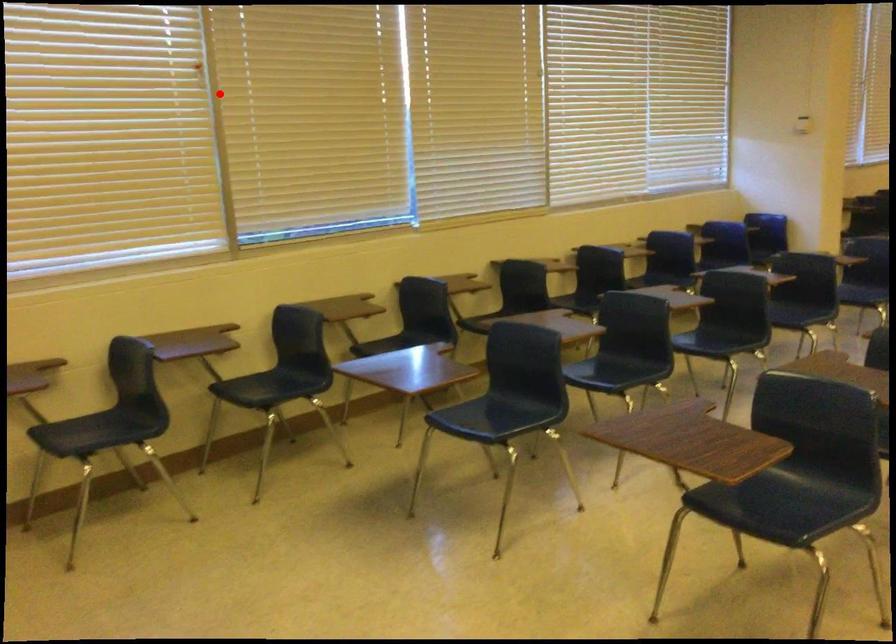
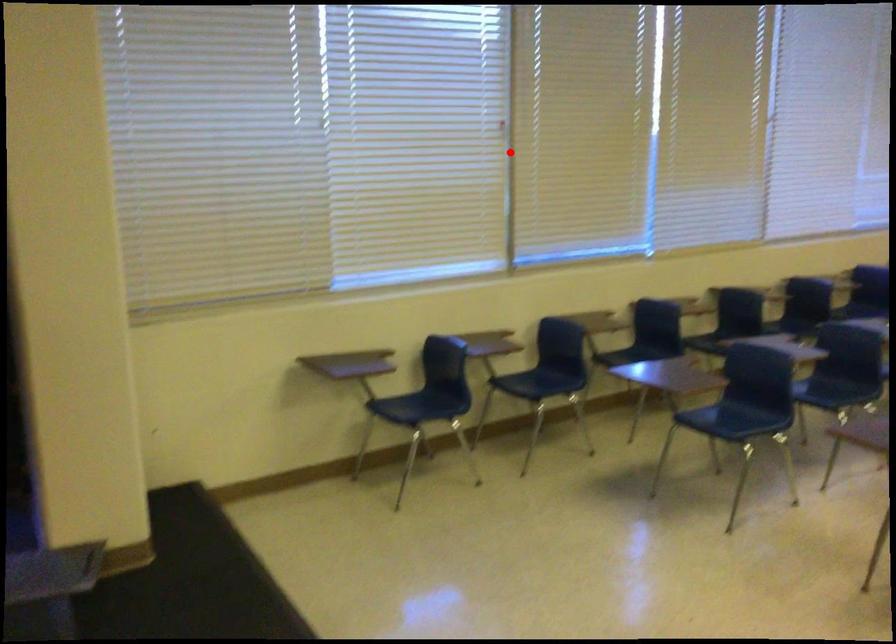
I am providing you with two images of the same scene from different viewpoints. A red point is marked on the first image and another point is marked on the second image. Is the red point in image1 aligned with the point shown in image2?

Yes